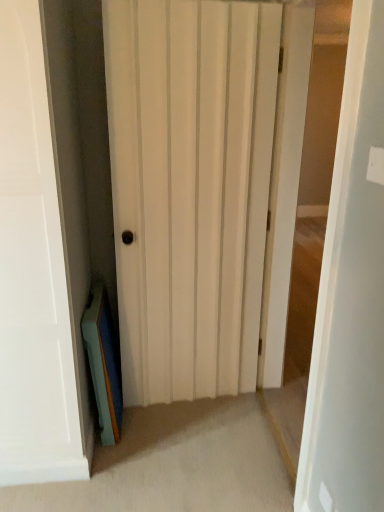
Question: From their relative heights in the image, would you say teal matte book at lower left is taller or shorter than white wood door at center, the second door viewed from the left?

Choices:
 (A) tall
 (B) short

Answer: (B)

Question: Is teal matte book at lower left to the left or to the right of white wood door at center, the 1th door when ordered from right to left, in the image?

Choices:
 (A) right
 (B) left

Answer: (B)

Question: Considering the real-world distances, which object is closest to the white wood door at center, the 1th door when ordered from right to left?

Choices:
 (A) teal matte book at lower left
 (B) white matte door at center, the second door viewed from the right

Answer: (B)

Question: Which object is the farthest from the white wood door at center, the second door viewed from the left?

Choices:
 (A) white matte door at center, the second door viewed from the right
 (B) teal matte book at lower left

Answer: (B)